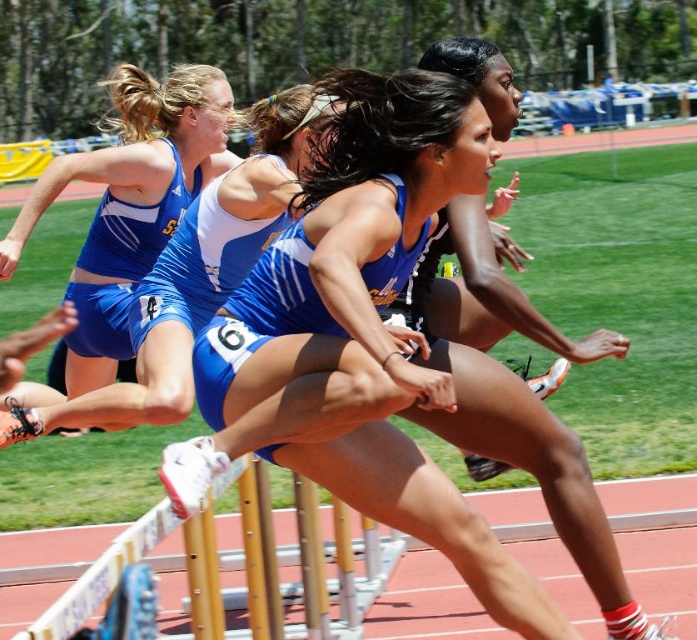
Does point (328, 221) lie behind point (279, 548)?

No.

Who is more forward, (302,369) or (316,625)?

Point (302,369)

Locate an element on the screen. The image size is (697, 640). blue fabric shorts at center is located at coordinates (359, 336).

In the scene shown: Is wooden hurdle at center above matte blue shorts at left?

No.

Does point (259, 628) lie behind point (210, 83)?

No, it is in front of (210, 83).

Where is `wooden hurdle at center`? wooden hurdle at center is located at coordinates (229, 570).

This screenshot has width=697, height=640. I want to click on wooden hurdle at center, so click(x=229, y=570).

Who is lower down, blue fabric shorts at center or matte blue shorts at left?

Positioned lower is blue fabric shorts at center.

Which is more to the left, blue fabric shorts at center or matte blue shorts at left?

matte blue shorts at left is more to the left.

Is point (369, 234) positioned before point (167, 186)?

Yes, it is.

Identify the location of blue fabric shorts at center. Image resolution: width=697 pixels, height=640 pixels. (359, 336).